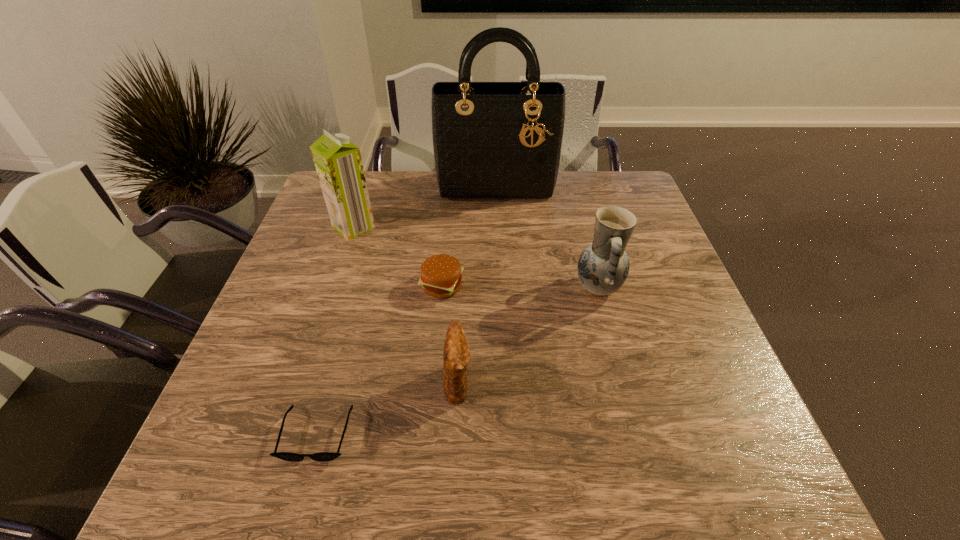
Where is `vacant space that's between the nearest object and the fifth nearest object`? This screenshot has height=540, width=960. vacant space that's between the nearest object and the fifth nearest object is located at coordinates (335, 330).

The width and height of the screenshot is (960, 540). I want to click on free space between the handbag and the nearest object, so click(x=406, y=310).

Where is `empty space that is in between the third tallest object and the tallest object`? The image size is (960, 540). empty space that is in between the third tallest object and the tallest object is located at coordinates (547, 237).

Find the location of `free space between the tallest object and the fifth tallest object`. free space between the tallest object and the fifth tallest object is located at coordinates (469, 236).

Identify the location of unoccupied position between the fifth farthest object and the shortest object. Image resolution: width=960 pixels, height=540 pixels. (388, 408).

This screenshot has height=540, width=960. Identify the location of vacant space that is in between the pottery and the second tallest object. (475, 257).

At what (x,y) coordinates should I click in order to perform the action: click on empty space between the soya milk and the clutch bag. Please return your answer as a coordinate pair (x, y). Image resolution: width=960 pixels, height=540 pixels. Looking at the image, I should click on (406, 304).

The width and height of the screenshot is (960, 540). Identify the location of vacant space that's between the shortest object and the handbag. [406, 310].

I want to click on the fifth closest object to the fourth shortest object, so click(x=338, y=162).

This screenshot has height=540, width=960. In order to click on object that stands as the fourth closest to the tallest object in this screenshot , I will do `click(456, 356)`.